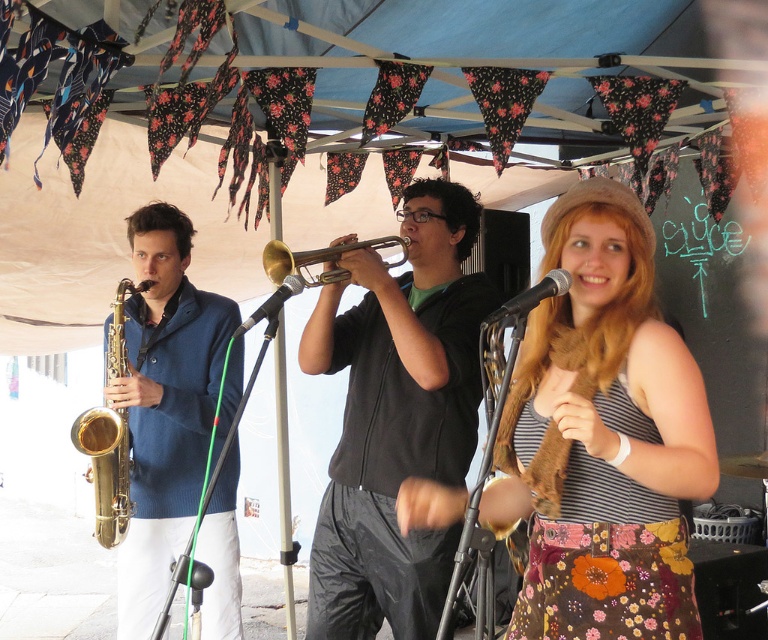
Question: Can you confirm if floral-patterned dress at center is positioned below black matte trumpet at center?

Choices:
 (A) no
 (B) yes

Answer: (A)

Question: Which point appears closest to the camera in this image?

Choices:
 (A) (151, 438)
 (B) (568, 512)
 (C) (415, 300)
 (D) (111, 413)

Answer: (B)

Question: Which point is closer to the camera?

Choices:
 (A) gold shiny saxophone at left
 (B) gold brass saxophone at left
 (C) gold brass trumpet at center

Answer: (C)

Question: Is floral-patterned dress at center positioned before gold brass saxophone at left?

Choices:
 (A) no
 (B) yes

Answer: (B)

Question: Observing the image, what is the correct spatial positioning of floral-patterned dress at center in reference to gold brass saxophone at left?

Choices:
 (A) right
 (B) left

Answer: (A)

Question: Among these points, which one is farthest from the camera?

Choices:
 (A) (114, 536)
 (B) (333, 480)
 (C) (144, 380)

Answer: (A)